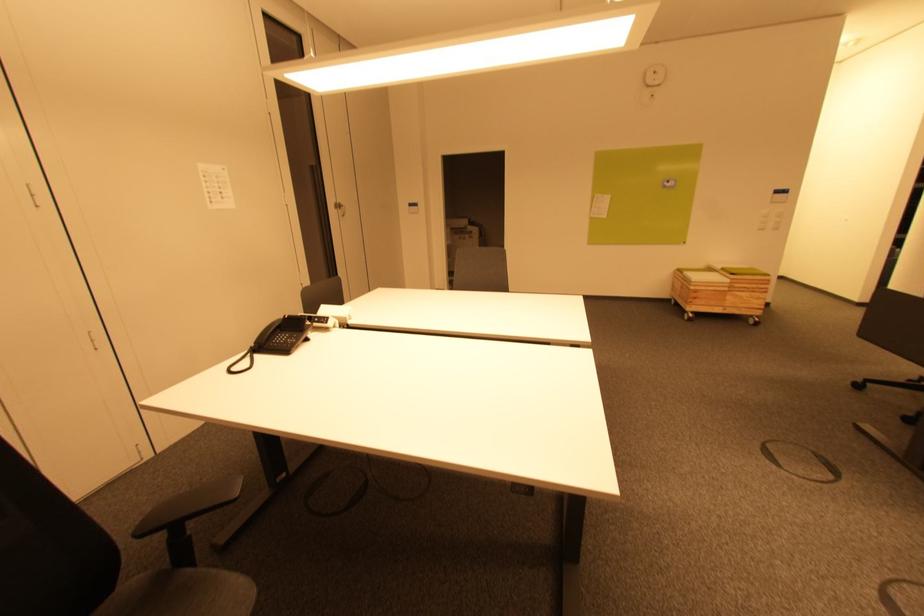
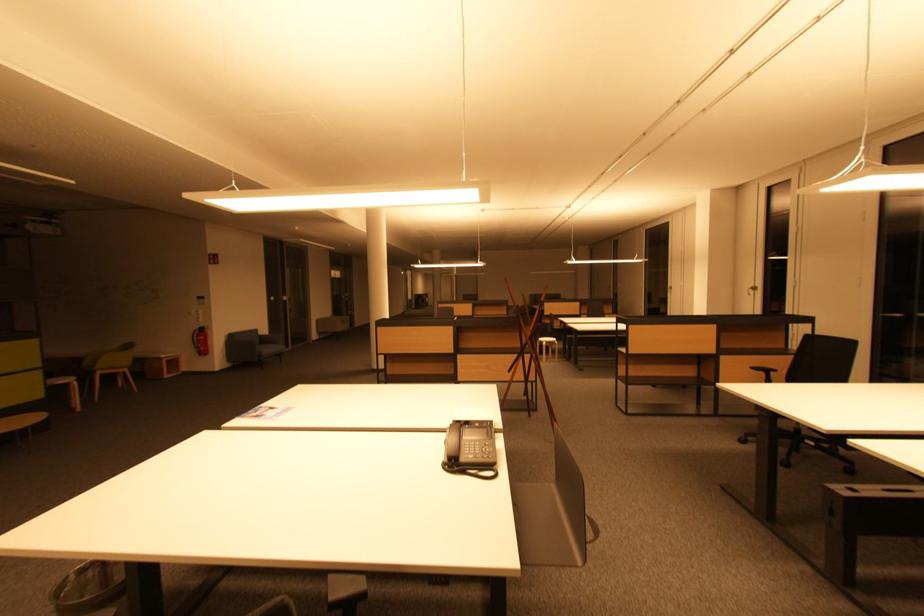
Question: I am providing you with two images of the same scene from different viewpoints. After the viewpoint changes to image2, which objects are now occluded?

Choices:
 (A) fire extinguisher handle
 (B) sofa sitting surface
 (C) chair sitting surface
 (D) copper milk can

Answer: (C)